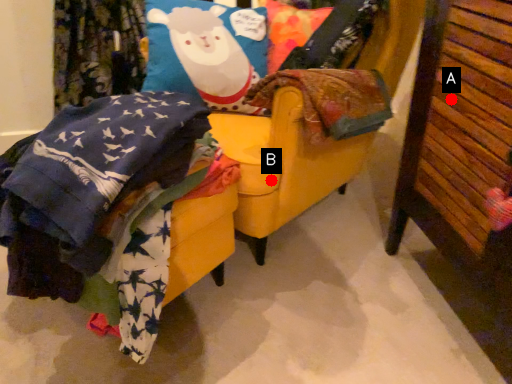
Question: Two points are circled on the image, labeled by A and B beside each circle. Which of the following is the closest to the observer?

Choices:
 (A) A is closer
 (B) B is closer

Answer: (A)